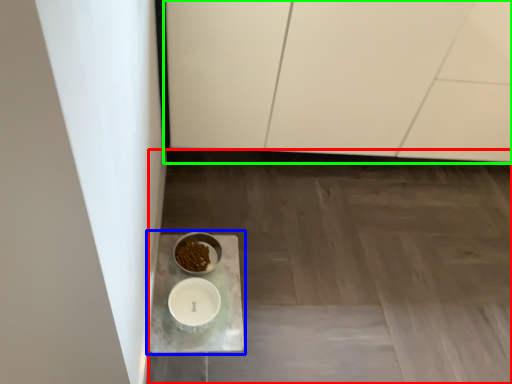
Question: Based on their relative distances, which object is farther from concrete (highlighted by a red box)? Choose from table (highlighted by a blue box) and cabinetry (highlighted by a green box).

Choices:
 (A) table
 (B) cabinetry

Answer: (B)